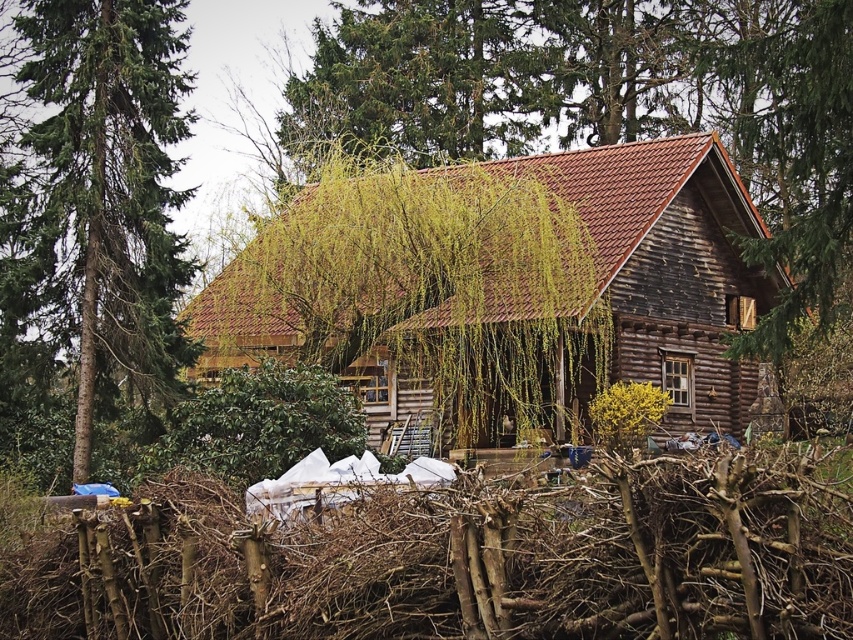
Which of these two, brown wooden fence at lower center or green coniferous tree at left, stands shorter?

With less height is brown wooden fence at lower center.

Consider the image. Is brown wooden fence at lower center to the right of green coniferous tree at left from the viewer's perspective?

Yes, brown wooden fence at lower center is to the right of green coniferous tree at left.

Does point (773, 582) come closer to viewer compared to point (96, 371)?

Yes, it is in front of point (96, 371).

You are a GUI agent. You are given a task and a screenshot of the screen. Output one action in this format:
    pyautogui.click(x=<x>, y=<y>)
    Task: Click on the brown wooden fence at lower center
    
    Given the screenshot: What is the action you would take?
    pyautogui.click(x=466, y=561)

Between brown wooden fence at lower center and weathered wood cabin at center, which one has less height?

Standing shorter between the two is brown wooden fence at lower center.

Is brown wooden fence at lower center further to the viewer compared to weathered wood cabin at center?

No, brown wooden fence at lower center is closer to the viewer.

I want to click on brown wooden fence at lower center, so click(x=466, y=561).

You are a GUI agent. You are given a task and a screenshot of the screen. Output one action in this format:
    pyautogui.click(x=<x>, y=<y>)
    Task: Click on the brown wooden fence at lower center
    
    Given the screenshot: What is the action you would take?
    pyautogui.click(x=466, y=561)

Between weathered wood cabin at center and green coniferous tree at left, which one appears on the right side from the viewer's perspective?

weathered wood cabin at center

Does weathered wood cabin at center appear under green coniferous tree at left?

Correct, weathered wood cabin at center is located below green coniferous tree at left.

Is point (405, 388) less distant than point (172, 74)?

Yes.

Locate an element on the screen. The width and height of the screenshot is (853, 640). weathered wood cabin at center is located at coordinates (666, 266).